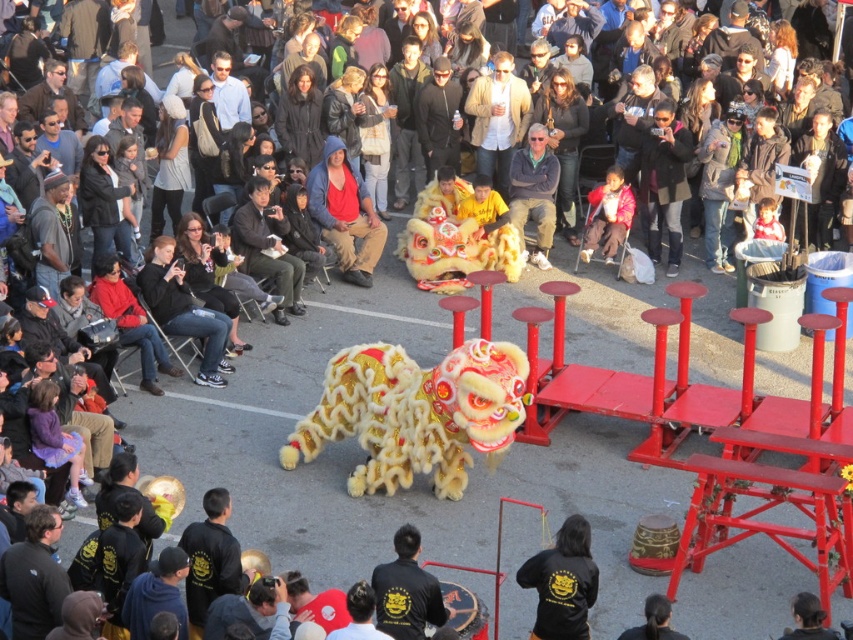
Question: Which point is closer to the camera?

Choices:
 (A) gold plush lion at center
 (B) black matte jacket at center

Answer: (B)

Question: Which point is farther from the camera taking this photo?

Choices:
 (A) (577, 604)
 (B) (642, 628)
 (C) (648, 180)
 (D) (606, 192)

Answer: (C)

Question: Can you confirm if yellow furry lion at center is positioned to the left of dark brown hair at center?

Choices:
 (A) no
 (B) yes

Answer: (B)

Question: Is yellow furry lion at center closer to camera compared to black hair at center?

Choices:
 (A) yes
 (B) no

Answer: (B)

Question: Which point appears farthest from the camera in this image?

Choices:
 (A) (379, 628)
 (B) (445, 257)

Answer: (B)

Question: Can you confirm if black matte jacket at lower center is thinner than dark gray fleece jacket at upper center?

Choices:
 (A) yes
 (B) no

Answer: (A)